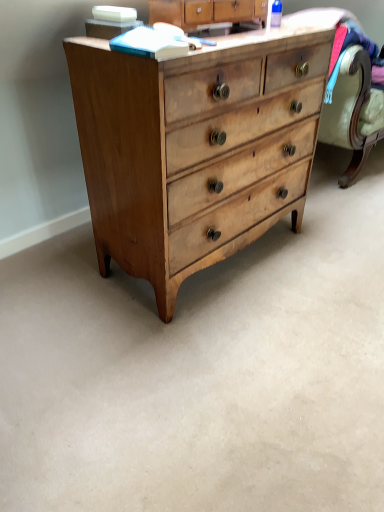
Question: Considering the relative sizes of light brown wood chest of drawers at center and light brown wood dresser at upper center in the image provided, is light brown wood chest of drawers at center taller than light brown wood dresser at upper center?

Choices:
 (A) no
 (B) yes

Answer: (B)

Question: From a real-world perspective, does light brown wood chest of drawers at center stand above light brown wood dresser at upper center?

Choices:
 (A) yes
 (B) no

Answer: (B)

Question: Is light brown wood chest of drawers at center facing towards light brown wood dresser at upper center?

Choices:
 (A) no
 (B) yes

Answer: (A)

Question: Considering the relative positions of light brown wood chest of drawers at center and light brown wood dresser at upper center in the image provided, is light brown wood chest of drawers at center to the left of light brown wood dresser at upper center from the viewer's perspective?

Choices:
 (A) yes
 (B) no

Answer: (A)

Question: From the image's perspective, would you say light brown wood chest of drawers at center is shown under light brown wood dresser at upper center?

Choices:
 (A) no
 (B) yes

Answer: (B)

Question: Is light brown wood chest of drawers at center positioned far away from light brown wood dresser at upper center?

Choices:
 (A) no
 (B) yes

Answer: (A)

Question: Can we say light brown wood dresser at upper center lies outside light brown wood chest of drawers at center?

Choices:
 (A) no
 (B) yes

Answer: (B)

Question: Does light brown wood dresser at upper center have a lesser height compared to light brown wood chest of drawers at center?

Choices:
 (A) no
 (B) yes

Answer: (B)

Question: Considering the relative sizes of light brown wood dresser at upper center and light brown wood chest of drawers at center in the image provided, is light brown wood dresser at upper center smaller than light brown wood chest of drawers at center?

Choices:
 (A) yes
 (B) no

Answer: (A)

Question: Is light brown wood dresser at upper center thinner than light brown wood chest of drawers at center?

Choices:
 (A) no
 (B) yes

Answer: (B)

Question: Does light brown wood dresser at upper center have a greater height compared to light brown wood chest of drawers at center?

Choices:
 (A) yes
 (B) no

Answer: (B)

Question: Does light brown wood dresser at upper center have a larger size compared to light brown wood chest of drawers at center?

Choices:
 (A) no
 (B) yes

Answer: (A)

Question: Does point (187, 198) appear closer or farther from the camera than point (233, 9)?

Choices:
 (A) farther
 (B) closer

Answer: (B)